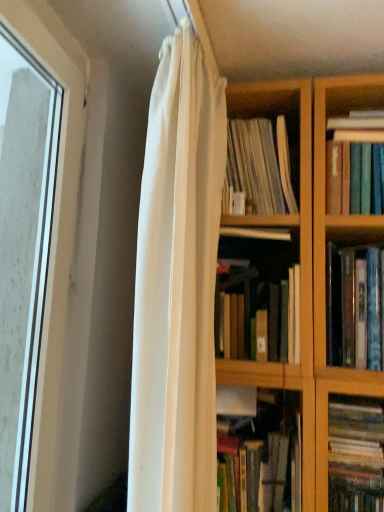
Question: Can you confirm if clear glass window at left is positioned to the right of hardcover book at upper right, the 1th book viewed from the top?

Choices:
 (A) no
 (B) yes

Answer: (A)

Question: Can you confirm if clear glass window at left is taller than hardcover book at upper right, the 1th book viewed from the top?

Choices:
 (A) yes
 (B) no

Answer: (A)

Question: From a real-world perspective, is clear glass window at left over hardcover book at upper right, acting as the fifth book starting from the bottom?

Choices:
 (A) no
 (B) yes

Answer: (A)

Question: Is clear glass window at left not close to hardcover book at upper right, acting as the fifth book starting from the bottom?

Choices:
 (A) no
 (B) yes

Answer: (A)

Question: Is clear glass window at left thinner than hardcover book at upper right, acting as the fifth book starting from the bottom?

Choices:
 (A) no
 (B) yes

Answer: (B)

Question: Does clear glass window at left touch hardcover book at upper right, acting as the fifth book starting from the bottom?

Choices:
 (A) yes
 (B) no

Answer: (B)

Question: Is white paper at center, arranged as the second book when viewed from the top, aimed at multicolored paperbacks at right, which is the first book in bottom-to-top order?

Choices:
 (A) no
 (B) yes

Answer: (A)

Question: Is white paper at center, arranged as the second book when viewed from the top, directly adjacent to multicolored paperbacks at right, arranged as the 5th book when viewed from the top?

Choices:
 (A) no
 (B) yes

Answer: (A)

Question: Can you confirm if white paper at center, the fourth book when ordered from bottom to top, is smaller than multicolored paperbacks at right, arranged as the 5th book when viewed from the top?

Choices:
 (A) no
 (B) yes

Answer: (A)

Question: Does white paper at center, arranged as the second book when viewed from the top, have a lesser height compared to multicolored paperbacks at right, which is the first book in bottom-to-top order?

Choices:
 (A) no
 (B) yes

Answer: (A)

Question: Is white paper at center, the fourth book when ordered from bottom to top, positioned in front of multicolored paperbacks at right, arranged as the 5th book when viewed from the top?

Choices:
 (A) yes
 (B) no

Answer: (B)

Question: Can you confirm if white paper at center, the fourth book when ordered from bottom to top, is thinner than multicolored paperbacks at right, arranged as the 5th book when viewed from the top?

Choices:
 (A) no
 (B) yes

Answer: (B)

Question: Is hardcover books at right, placed as the 3th book when sorted from bottom to top, positioned with its back to clear glass window at left?

Choices:
 (A) yes
 (B) no

Answer: (B)